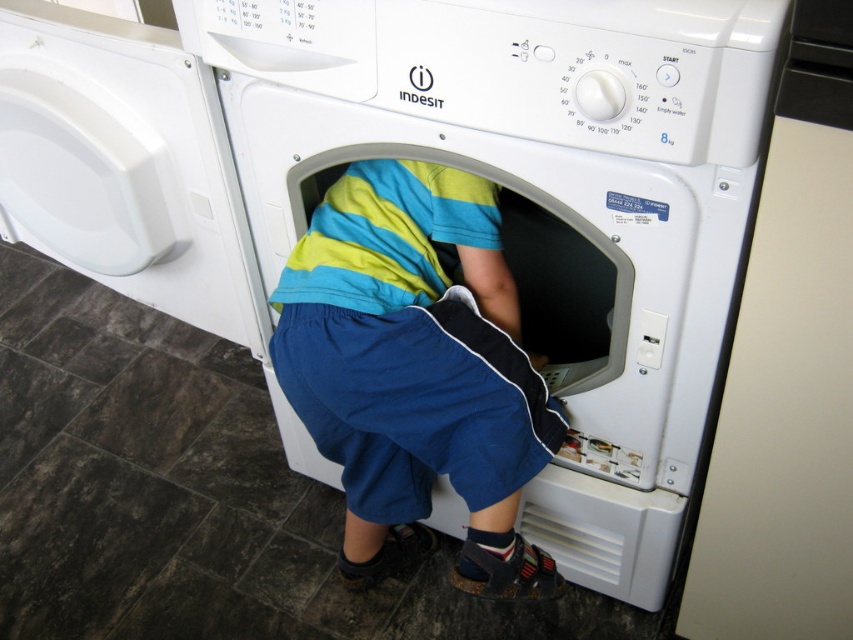
Question: Does white plastic washing machine at center appear on the right side of blue cotton shorts at center?

Choices:
 (A) no
 (B) yes

Answer: (B)

Question: Which object is closer to the camera taking this photo?

Choices:
 (A) white plastic washing machine at center
 (B) blue cotton shorts at center

Answer: (A)

Question: Which point is closer to the camera?

Choices:
 (A) blue cotton shorts at center
 (B) white plastic washing machine at center

Answer: (B)

Question: From the image, what is the correct spatial relationship of blue cotton shorts at center in relation to white plastic washing machine at left?

Choices:
 (A) below
 (B) above

Answer: (A)

Question: Among these points, which one is farthest from the camera?

Choices:
 (A) (35, 77)
 (B) (320, 19)
 (C) (283, 305)

Answer: (A)

Question: Can you confirm if white plastic washing machine at center is thinner than white plastic washing machine at left?

Choices:
 (A) yes
 (B) no

Answer: (B)